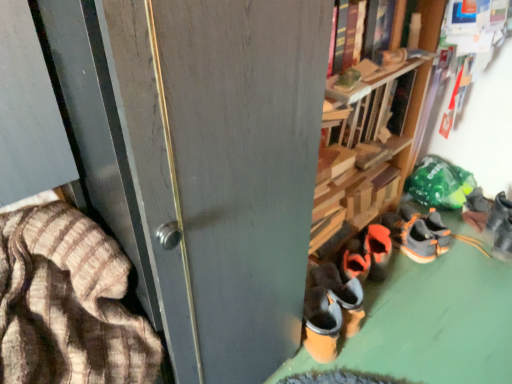
What is the approximate width of orange suede shoes at center, which is counted as the third footwear, starting from the left?

The width of orange suede shoes at center, which is counted as the third footwear, starting from the left, is 1.54 meters.

How much space does dark brown suede shoes at lower right, which ranks as the 5th footwear in right-to-left order, occupy vertically?

dark brown suede shoes at lower right, which ranks as the 5th footwear in right-to-left order, is 7.98 inches in height.

In order to face gray suede sneakers at lower right, the 5th footwear when ordered from left to right, should I rotate leftwards or rightwards?

A 31.247 degree turn to the right will do.

Where is `brown striped fabric at left`? brown striped fabric at left is located at coordinates (68, 303).

The width and height of the screenshot is (512, 384). Identify the location of orange suede sneaker at lower right, which is the second footwear from right to left. coord(501,226).

How different are the orientations of hardcover book at upper center and brown striped fabric at left in degrees?

The angle between the facing direction of hardcover book at upper center and the facing direction of brown striped fabric at left is 3.57 degrees.

Does hardcover book at upper center have a greater width compared to brown striped fabric at left?

No, hardcover book at upper center is not wider than brown striped fabric at left.

Can you confirm if hardcover book at upper center is positioned to the left of brown striped fabric at left?

No.

Which is less distant, (346, 52) or (42, 345)?

The point (42, 345) is closer to the camera.

From the image's perspective, is orange suede shoes at center, the fourth footwear viewed from the right, positioned above or below gray suede sneakers at lower right, the 5th footwear when ordered from left to right?

orange suede shoes at center, the fourth footwear viewed from the right, is situated lower than gray suede sneakers at lower right, the 5th footwear when ordered from left to right, in the image.

Considering the sizes of objects orange suede shoes at center, which ranks as the second footwear in left-to-right order, and gray suede sneakers at lower right, the 5th footwear when ordered from left to right, in the image provided, who is shorter, orange suede shoes at center, which ranks as the second footwear in left-to-right order, or gray suede sneakers at lower right, the 5th footwear when ordered from left to right,?

gray suede sneakers at lower right, the 5th footwear when ordered from left to right, is shorter.

Is orange suede shoes at center, the fourth footwear viewed from the right, inside or outside of gray suede sneakers at lower right, the 5th footwear when ordered from left to right?

orange suede shoes at center, the fourth footwear viewed from the right, lies outside gray suede sneakers at lower right, the 5th footwear when ordered from left to right.

From a real-world perspective, is orange suede shoes at center, the fourth footwear viewed from the right, positioned over gray suede sneakers at lower right, which appears as the first footwear when viewed from the right, based on gravity?

Yes.

Relative to orange suede shoes at center, the 3th footwear from the right, is dark brown suede shoes at lower right, which ranks as the 5th footwear in right-to-left order, in front or behind?

dark brown suede shoes at lower right, which ranks as the 5th footwear in right-to-left order, is behind orange suede shoes at center, the 3th footwear from the right.

Is dark brown suede shoes at lower right, which ranks as the 5th footwear in right-to-left order, next to orange suede shoes at center, which is counted as the third footwear, starting from the left, and touching it?

Absolutely, dark brown suede shoes at lower right, which ranks as the 5th footwear in right-to-left order, is next to and touching orange suede shoes at center, which is counted as the third footwear, starting from the left.

Between dark brown suede shoes at lower right, which is the first footwear in left-to-right order, and orange suede shoes at center, which is counted as the third footwear, starting from the left, which one has smaller size?

With smaller size is dark brown suede shoes at lower right, which is the first footwear in left-to-right order.

What's the angular difference between dark brown suede shoes at lower right, which is the first footwear in left-to-right order, and hardcover book at upper center's facing directions?

166 degrees separate the facing orientations of dark brown suede shoes at lower right, which is the first footwear in left-to-right order, and hardcover book at upper center.

Is hardcover book at upper center surrounded by dark brown suede shoes at lower right, which ranks as the 5th footwear in right-to-left order?

No, hardcover book at upper center is not surrounded by dark brown suede shoes at lower right, which ranks as the 5th footwear in right-to-left order.

From a real-world perspective, between dark brown suede shoes at lower right, which is the first footwear in left-to-right order, and hardcover book at upper center, who is vertically higher?

hardcover book at upper center is physically above.

Could you tell me if dark brown suede shoes at lower right, which is the first footwear in left-to-right order, is facing hardcover book at upper center?

No, dark brown suede shoes at lower right, which is the first footwear in left-to-right order, is not facing towards hardcover book at upper center.

From a real-world perspective, which is physically below, dark brown suede shoes at lower right, which is the first footwear in left-to-right order, or orange suede shoes at center, the fourth footwear viewed from the right?

From a 3D spatial view, orange suede shoes at center, the fourth footwear viewed from the right, is below.

Is dark brown suede shoes at lower right, which ranks as the 5th footwear in right-to-left order, oriented towards orange suede shoes at center, which ranks as the second footwear in left-to-right order?

No, dark brown suede shoes at lower right, which ranks as the 5th footwear in right-to-left order, is not turned towards orange suede shoes at center, which ranks as the second footwear in left-to-right order.

Which point is more forward, (368, 230) or (376, 239)?

The point (376, 239) is closer.

From the image's perspective, is dark brown suede shoes at lower right, which is the first footwear in left-to-right order, located above or below orange suede shoes at center, the fourth footwear viewed from the right?

Clearly, from the image's perspective, dark brown suede shoes at lower right, which is the first footwear in left-to-right order, is below orange suede shoes at center, the fourth footwear viewed from the right.

Would you consider orange suede shoes at center, the 3th footwear from the right, to be distant from gray suede sneakers at lower right, the 5th footwear when ordered from left to right?

They are positioned close to each other.

Does orange suede shoes at center, which is counted as the third footwear, starting from the left, turn towards gray suede sneakers at lower right, which appears as the first footwear when viewed from the right?

No, orange suede shoes at center, which is counted as the third footwear, starting from the left, is not aimed at gray suede sneakers at lower right, which appears as the first footwear when viewed from the right.

Visually, is orange suede shoes at center, the 3th footwear from the right, positioned to the left or to the right of gray suede sneakers at lower right, the 5th footwear when ordered from left to right?

orange suede shoes at center, the 3th footwear from the right, is positioned on gray suede sneakers at lower right, the 5th footwear when ordered from left to right,'s left side.

How different are the orientations of orange suede shoes at center, the 3th footwear from the right, and gray suede sneakers at lower right, which appears as the first footwear when viewed from the right, in degrees?

There is a 171-degree angle between the facing directions of orange suede shoes at center, the 3th footwear from the right, and gray suede sneakers at lower right, which appears as the first footwear when viewed from the right.

Is orange suede shoes at center, which is counted as the third footwear, starting from the left, shorter than orange suede sneaker at lower right, which is the second footwear from right to left?

Yes.

Could you tell me if orange suede shoes at center, the 3th footwear from the right, is facing orange suede sneaker at lower right, which is the second footwear from right to left?

No, orange suede shoes at center, the 3th footwear from the right, is not aimed at orange suede sneaker at lower right, which is the second footwear from right to left.

Is orange suede shoes at center, which is counted as the third footwear, starting from the left, to the right of orange suede sneaker at lower right, which is counted as the fourth footwear, starting from the left, from the viewer's perspective?

No.

From a real-world perspective, which footwear is the 4th one underneath the orange suede sneaker at lower right, which is the second footwear from right to left? Please provide its 2D coordinates.

[(432, 232)]

Where is `blanket below the hardcover book at upper center (from a real-world perspective)`? Image resolution: width=512 pixels, height=384 pixels. blanket below the hardcover book at upper center (from a real-world perspective) is located at coordinates (68, 303).

From a real-world perspective, which footwear is the 1st one above the gray suede sneakers at lower right, the 5th footwear when ordered from left to right? Please provide its 2D coordinates.

[(378, 251)]

When comparing their distances from orange suede shoes at center, the 3th footwear from the right, does gray suede sneakers at lower right, the 5th footwear when ordered from left to right, or matte gray screen door at center seem closer?

Among the two, gray suede sneakers at lower right, the 5th footwear when ordered from left to right, is located nearer to orange suede shoes at center, the 3th footwear from the right.

Based on their spatial positions, is matte gray screen door at center or orange suede shoes at center, which ranks as the second footwear in left-to-right order, further from hardcover book at upper center?

Among the two, orange suede shoes at center, which ranks as the second footwear in left-to-right order, is located further to hardcover book at upper center.

From the picture: Based on their spatial positions, is orange suede sneaker at lower right, which is counted as the fourth footwear, starting from the left, or gray suede sneakers at lower right, which appears as the first footwear when viewed from the right, further from orange suede shoes at center, which is counted as the third footwear, starting from the left?

Among the two, orange suede sneaker at lower right, which is counted as the fourth footwear, starting from the left, is located further to orange suede shoes at center, which is counted as the third footwear, starting from the left.

Estimate the real-world distances between objects in this image. Which object is further from orange suede sneaker at lower right, which is counted as the fourth footwear, starting from the left, orange suede shoes at center, the 3th footwear from the right, or orange suede shoes at center, which ranks as the second footwear in left-to-right order?

Based on the image, orange suede shoes at center, which ranks as the second footwear in left-to-right order, appears to be further to orange suede sneaker at lower right, which is counted as the fourth footwear, starting from the left.

Looking at the image, which one is located closer to orange suede shoes at center, the 3th footwear from the right, matte gray screen door at center or hardcover book at upper center?

hardcover book at upper center.

Which object lies nearer to the anchor point orange suede shoes at center, which is counted as the third footwear, starting from the left, matte gray screen door at center or gray suede sneakers at lower right, the 5th footwear when ordered from left to right?

Based on the image, gray suede sneakers at lower right, the 5th footwear when ordered from left to right, appears to be nearer to orange suede shoes at center, which is counted as the third footwear, starting from the left.

Considering their positions, is gray suede sneakers at lower right, which appears as the first footwear when viewed from the right, positioned further to orange suede shoes at center, the fourth footwear viewed from the right, than orange suede sneaker at lower right, which is counted as the fourth footwear, starting from the left?

orange suede sneaker at lower right, which is counted as the fourth footwear, starting from the left, lies further to orange suede shoes at center, the fourth footwear viewed from the right, than the other object.

From the image, which object appears to be nearer to brown striped fabric at left, dark brown suede shoes at lower right, which ranks as the 5th footwear in right-to-left order, or hardcover book at upper center?

dark brown suede shoes at lower right, which ranks as the 5th footwear in right-to-left order, lies closer to brown striped fabric at left than the other object.

Locate an element on the screen. The height and width of the screenshot is (384, 512). blanket that lies between hardcover book at upper center and dark brown suede shoes at lower right, which is the first footwear in left-to-right order, from top to bottom is located at coordinates (68, 303).

You are a GUI agent. You are given a task and a screenshot of the screen. Output one action in this format:
    pyautogui.click(x=<x>, y=<y>)
    Task: Click on the book positioned between brown striped fabric at left and orange suede shoes at center, the fourth footwear viewed from the right, from near to far
    This screenshot has width=512, height=384.
    Given the screenshot: What is the action you would take?
    pyautogui.click(x=377, y=27)

Where is `blanket located between matte gray screen door at center and orange suede shoes at center, the fourth footwear viewed from the right, in the depth direction`? This screenshot has width=512, height=384. blanket located between matte gray screen door at center and orange suede shoes at center, the fourth footwear viewed from the right, in the depth direction is located at coordinates (68, 303).

Find the location of a particular element. The image size is (512, 384). screen door between brown striped fabric at left and orange suede shoes at center, the 3th footwear from the right, from left to right is located at coordinates (224, 168).